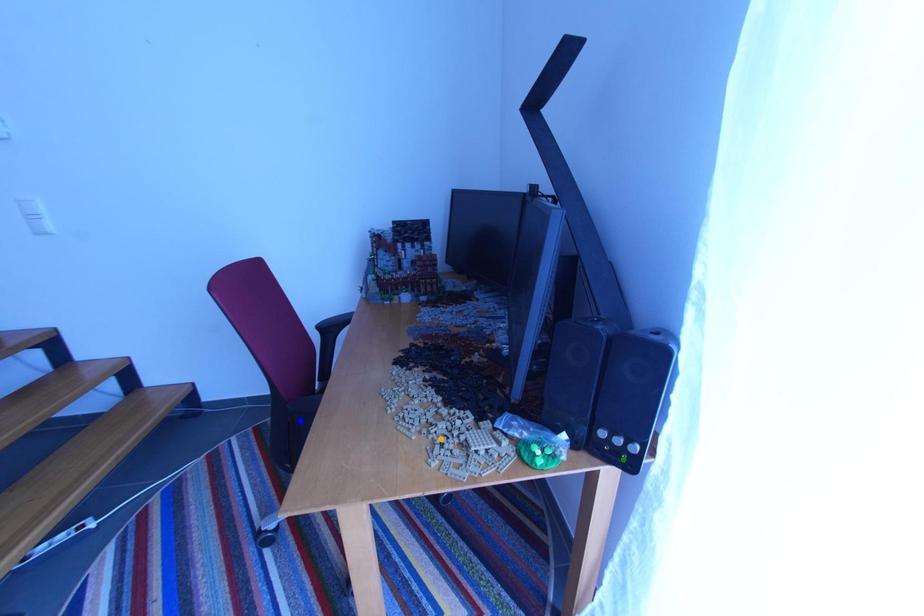
Order these from nearest to farthest:
green point
blue point
orange point

green point
orange point
blue point